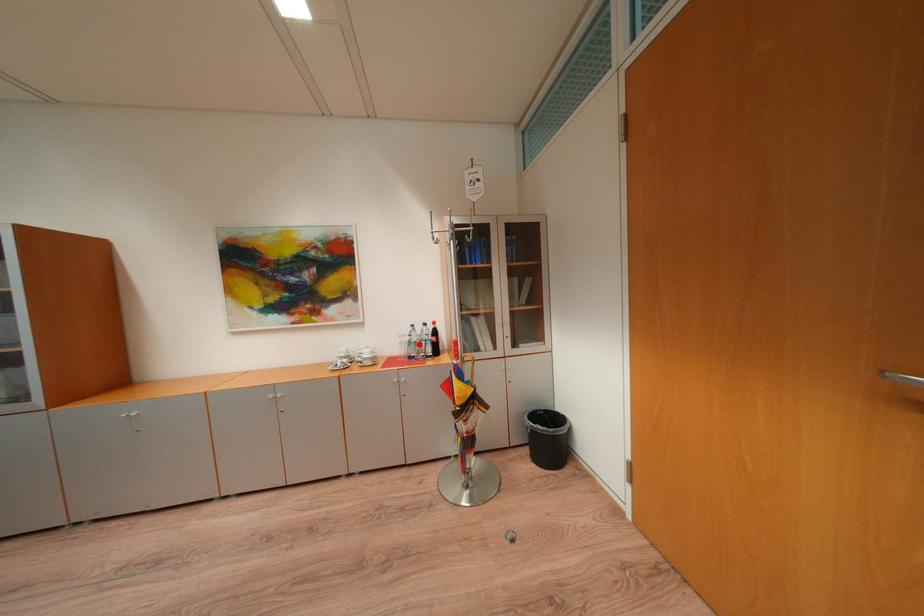
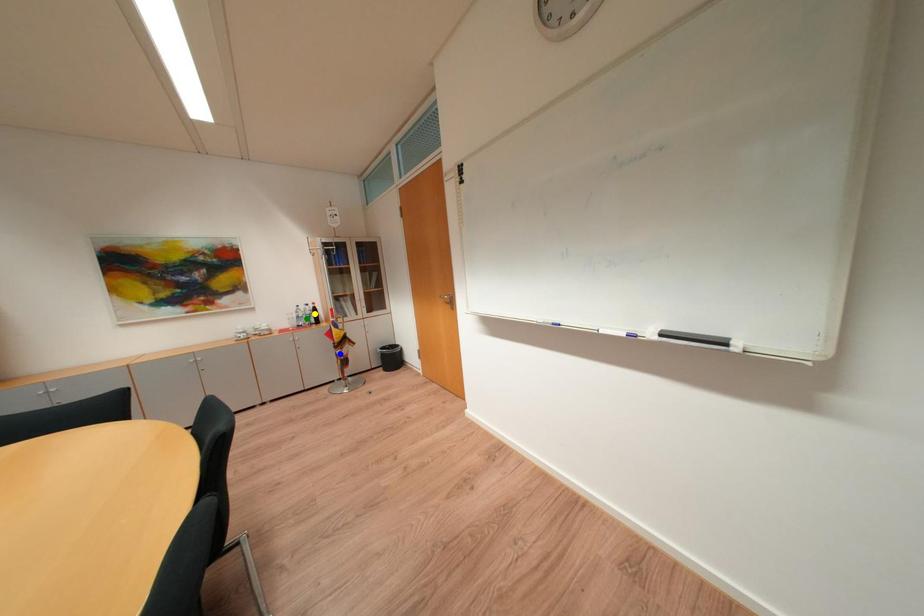
Question: I am providing you with two images of the same scene from different viewpoints. A red point is marked on the first image. You are given multiple points on the second image. Which point in image 2 is actually the same real-world point as the red point in image 1?

Choices:
 (A) yellow point
 (B) green point
 (C) blue point

Answer: (B)